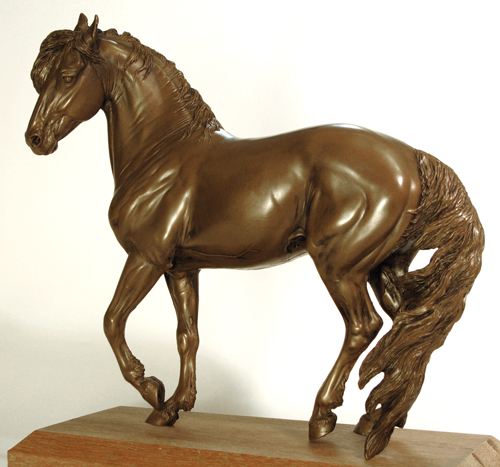
Identify the location of sculpture. tap(261, 188).